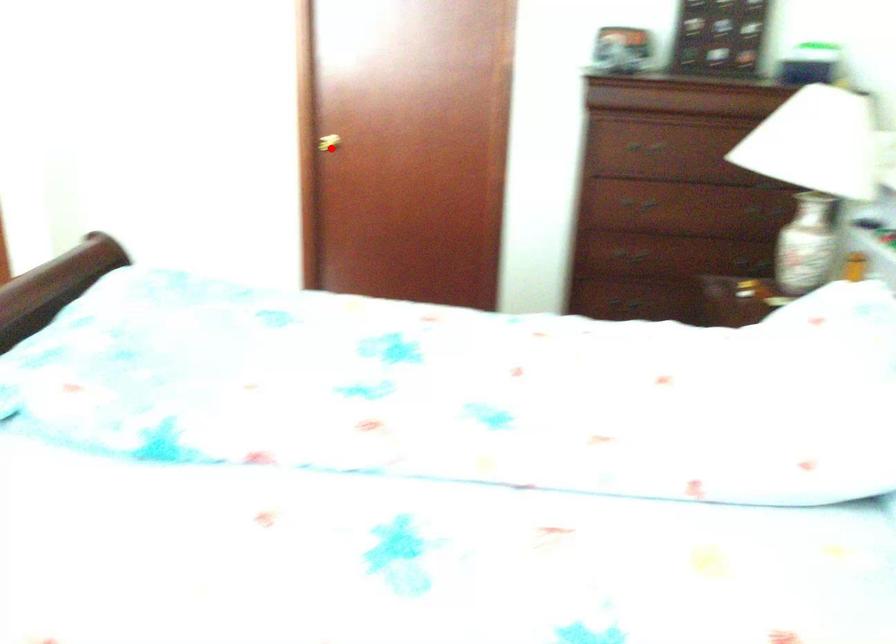
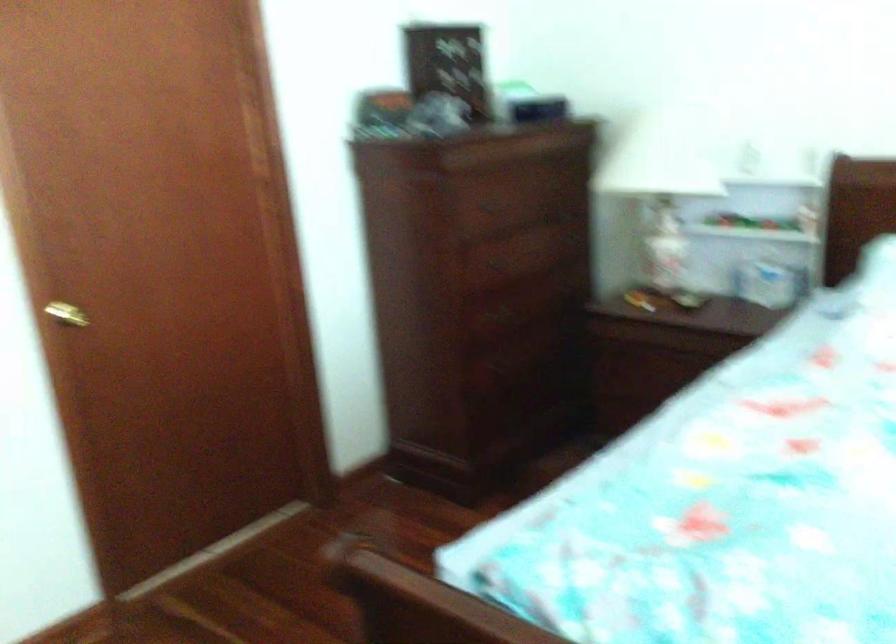
The point at the highlighted location is marked in the first image. Where is the corresponding point in the second image?

(66, 314)